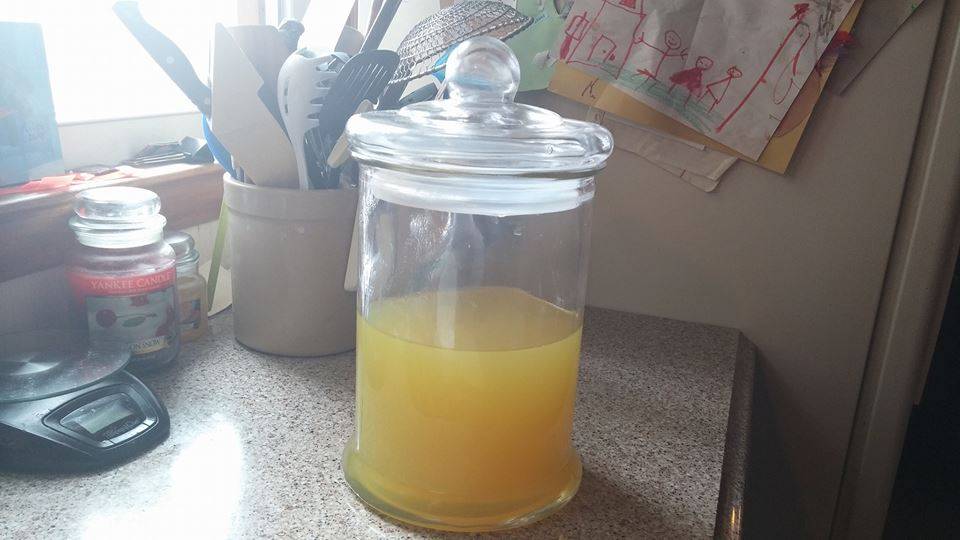
The image size is (960, 540). In order to click on 3 glass jars in this screenshot , I will do `click(478, 256)`, `click(170, 233)`, `click(204, 293)`.